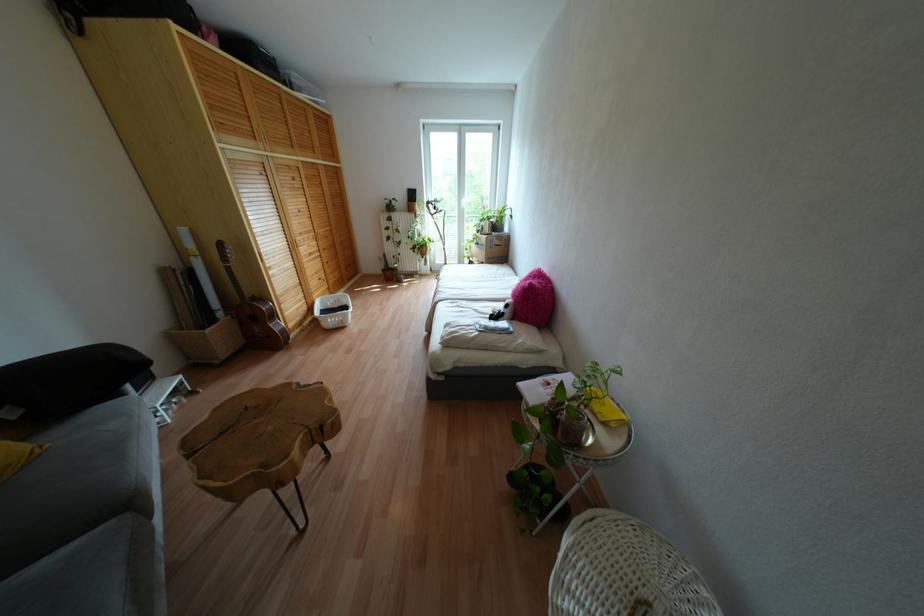
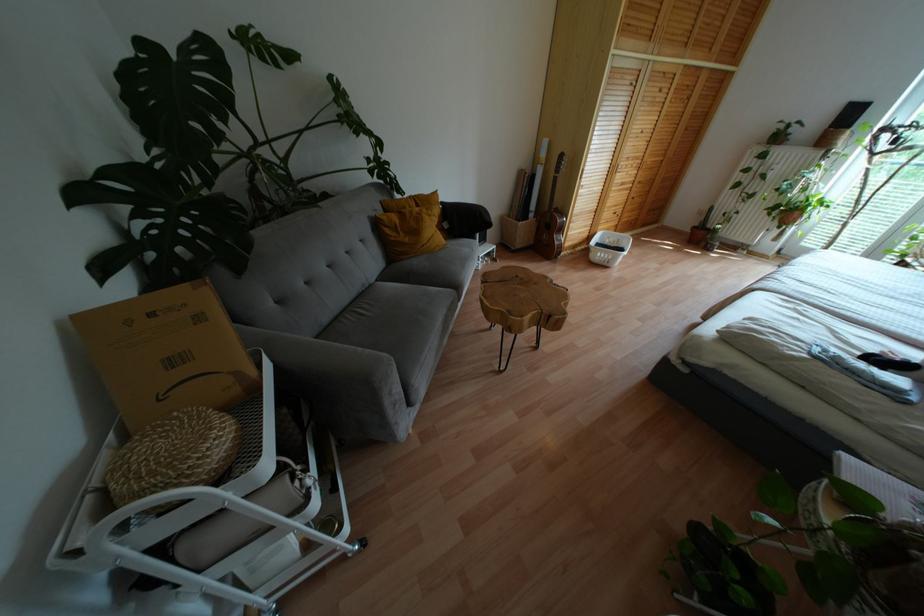
The first image is from the beginning of the video and the second image is from the end. How did the camera likely rotate when shooting the video?

The rotation direction of the camera is left-down.